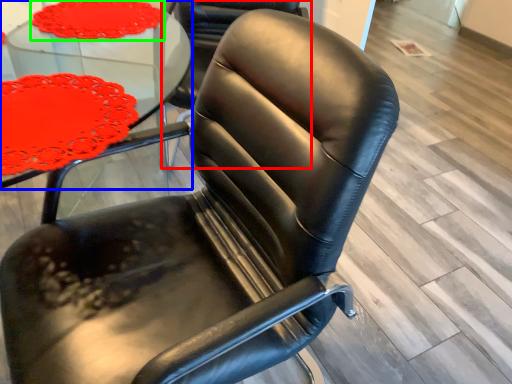
Question: Which object is positioned closest to chair (highlighted by a red box)? Select from table (highlighted by a blue box) and tablecloth (highlighted by a green box).

Choices:
 (A) table
 (B) tablecloth

Answer: (A)